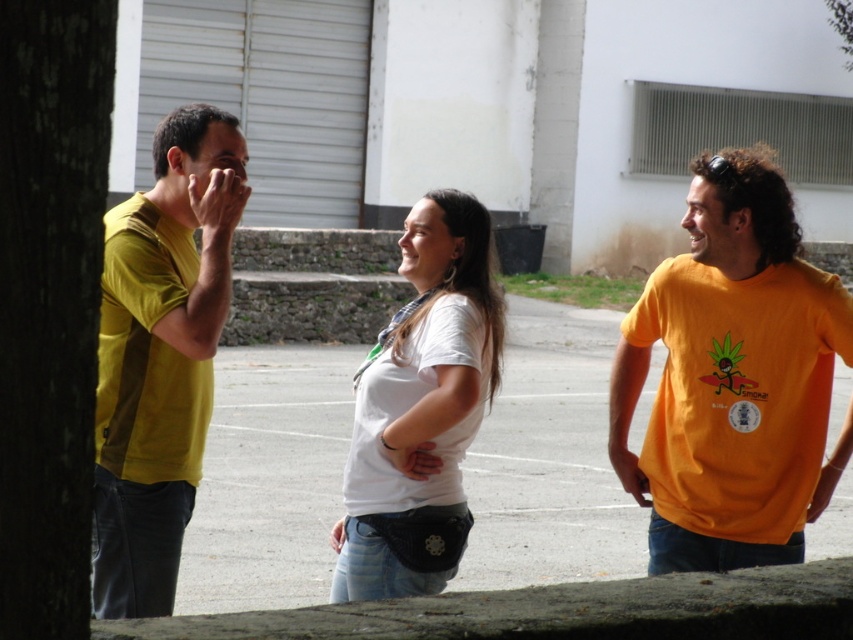
Question: Which object appears closest to the camera in this image?

Choices:
 (A) white matte shirt at center
 (B) yellow matte shirt at left

Answer: (A)

Question: Can you confirm if orange matte t-shirt at right is positioned above yellow matte shirt at left?

Choices:
 (A) no
 (B) yes

Answer: (A)

Question: Which of the following is the closest to the observer?

Choices:
 (A) (196, 109)
 (B) (737, 230)

Answer: (B)

Question: Is yellow matte shirt at left in front of white matte shirt at center?

Choices:
 (A) yes
 (B) no

Answer: (B)

Question: Is orange matte t-shirt at right further to camera compared to yellow matte shirt at left?

Choices:
 (A) no
 (B) yes

Answer: (B)

Question: Which point appears farthest from the camera in this image?

Choices:
 (A) (107, 576)
 (B) (653, 408)
 (C) (491, 304)

Answer: (B)